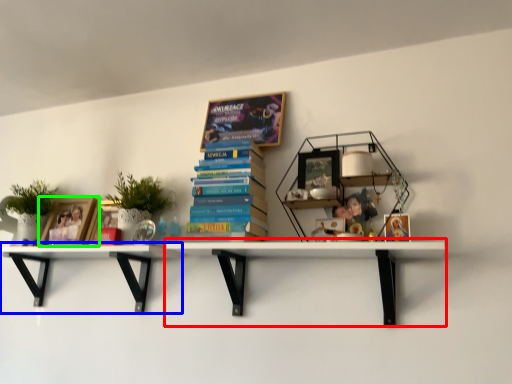
Question: Based on their relative distances, which object is nearer to shelf (highlighted by a red box)? Choose from shelf (highlighted by a blue box) and book cover (highlighted by a green box).

Choices:
 (A) shelf
 (B) book cover

Answer: (A)